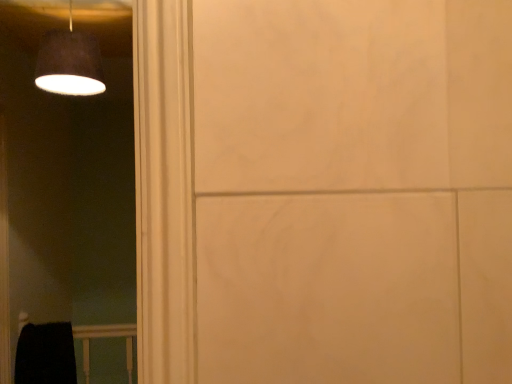
Question: From a real-world perspective, does matte black lampshade at upper left stand above black matte balustrade at lower left?

Choices:
 (A) no
 (B) yes

Answer: (B)

Question: Is matte black lampshade at upper left shorter than black matte balustrade at lower left?

Choices:
 (A) yes
 (B) no

Answer: (A)

Question: Can you confirm if matte black lampshade at upper left is positioned to the right of black matte balustrade at lower left?

Choices:
 (A) no
 (B) yes

Answer: (B)

Question: Is matte black lampshade at upper left taller than black matte balustrade at lower left?

Choices:
 (A) yes
 (B) no

Answer: (B)

Question: Are matte black lampshade at upper left and black matte balustrade at lower left beside each other?

Choices:
 (A) yes
 (B) no

Answer: (B)

Question: Is matte black lampshade at upper left positioned with its back to black matte balustrade at lower left?

Choices:
 (A) yes
 (B) no

Answer: (B)

Question: Does black matte balustrade at lower left have a greater width compared to matte black lampshade at upper left?

Choices:
 (A) no
 (B) yes

Answer: (A)

Question: Is black matte balustrade at lower left further to the viewer compared to matte black lampshade at upper left?

Choices:
 (A) yes
 (B) no

Answer: (A)

Question: Is black matte balustrade at lower left placed right next to matte black lampshade at upper left?

Choices:
 (A) no
 (B) yes

Answer: (A)

Question: Is black matte balustrade at lower left positioned before matte black lampshade at upper left?

Choices:
 (A) no
 (B) yes

Answer: (A)

Question: Could you tell me if black matte balustrade at lower left is facing matte black lampshade at upper left?

Choices:
 (A) yes
 (B) no

Answer: (B)

Question: From the image's perspective, is black matte balustrade at lower left on top of matte black lampshade at upper left?

Choices:
 (A) yes
 (B) no

Answer: (B)

Question: From a real-world perspective, is black matte balustrade at lower left physically located above or below matte black lampshade at upper left?

Choices:
 (A) below
 (B) above

Answer: (A)